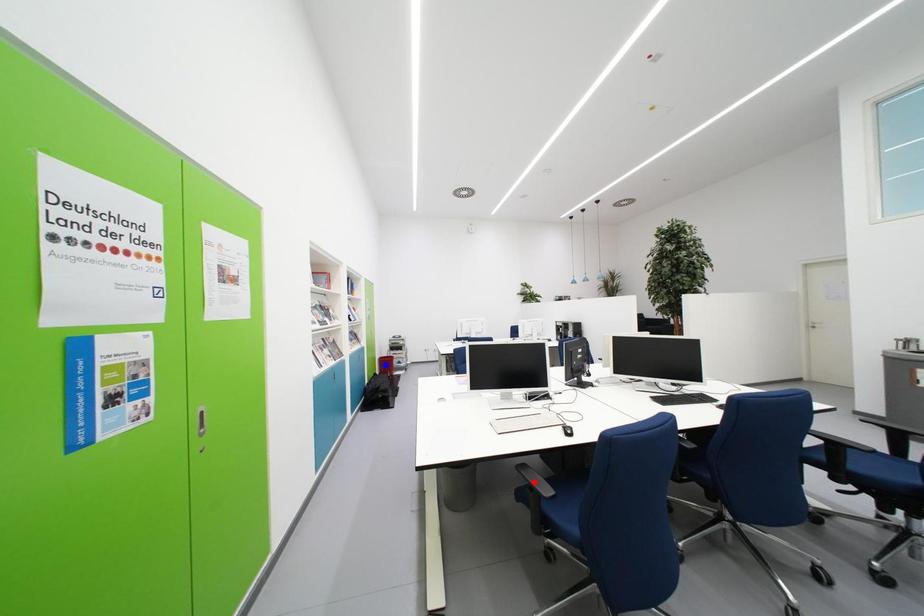
Question: Two points are marked on the image. Which point is closer to the camera?

Choices:
 (A) Blue point is closer.
 (B) Red point is closer.

Answer: (B)